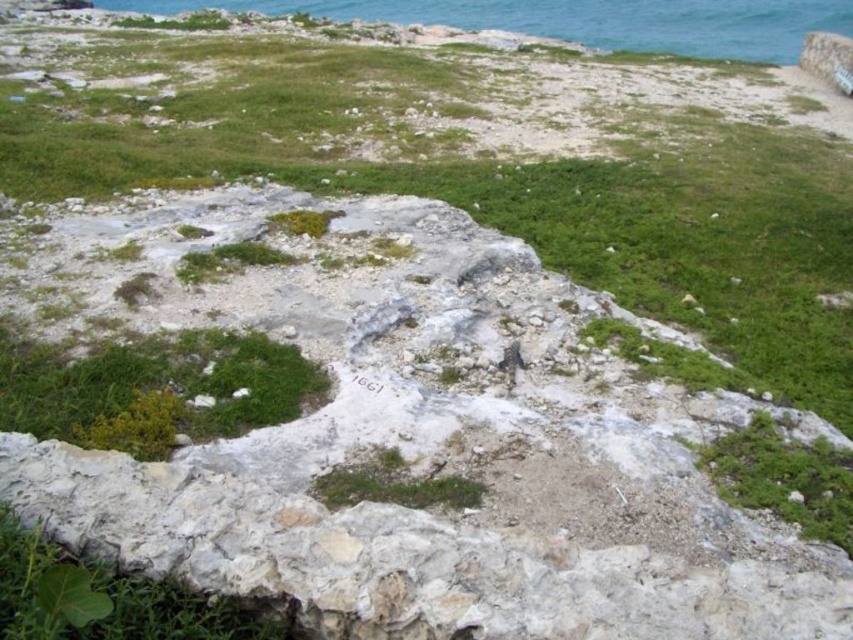
Question: Which point is farther to the camera?

Choices:
 (A) blue water at upper right
 (B) green leafy grass at center

Answer: (A)

Question: Does green leafy grass at center lie behind blue water at upper right?

Choices:
 (A) yes
 (B) no

Answer: (B)

Question: Which point is farther to the camera?

Choices:
 (A) green leafy grass at center
 (B) blue water at upper right

Answer: (B)

Question: Among these points, which one is farthest from the camera?

Choices:
 (A) (737, 28)
 (B) (21, 397)

Answer: (A)

Question: Where is green leafy grass at center located in relation to blue water at upper right in the image?

Choices:
 (A) below
 (B) above

Answer: (A)

Question: Does green leafy grass at center appear over blue water at upper right?

Choices:
 (A) yes
 (B) no

Answer: (B)